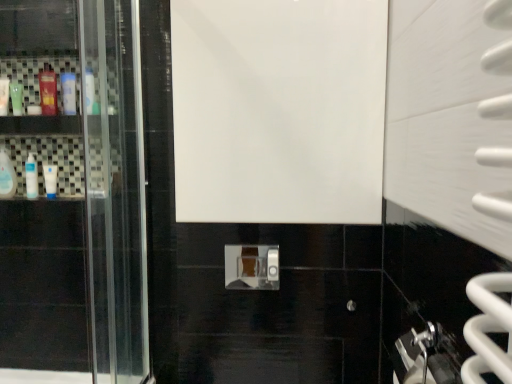
What is the approximate height of white glossy bottle at left, acting as the fourth mouthwash starting from the right?

white glossy bottle at left, acting as the fourth mouthwash starting from the right, is 8.42 inches in height.

Find the location of `white glossy door at center`. white glossy door at center is located at coordinates (74, 197).

Locate an element on the screen. This screenshot has height=384, width=512. translucent plastic mouthwash at upper left, acting as the fifth mouthwash starting from the left is located at coordinates (48, 90).

How different are the orientations of clear plastic bottle at left, which is the first mouthwash in left-to-right order, and white glossy bottle at left, positioned as the third mouthwash in left-to-right order, in degrees?

They differ by 0.000116 degrees in their facing directions.

At what (x,y) coordinates should I click in order to perform the action: click on the 2nd mouthwash behind the clear plastic bottle at left, which is the first mouthwash in left-to-right order, counting from the anchor's position. Please return your answer as a coordinate pair (x, y). The width and height of the screenshot is (512, 384). Looking at the image, I should click on (31, 177).

Are clear plastic bottle at left, which is the first mouthwash in left-to-right order, and white glossy bottle at left, acting as the fourth mouthwash starting from the right, located far from each other?

Actually, clear plastic bottle at left, which is the first mouthwash in left-to-right order, and white glossy bottle at left, acting as the fourth mouthwash starting from the right, are a little close together.

Is clear plastic bottle at left, the 6th mouthwash from the right, situated inside white glossy bottle at left, acting as the fourth mouthwash starting from the right, or outside?

The correct answer is: outside.

Which object is positioned more to the right, white glossy bottle at left, acting as the fourth mouthwash starting from the right, or white glossy door at center?

white glossy door at center is more to the right.

From the image's perspective, is white glossy bottle at left, acting as the fourth mouthwash starting from the right, located beneath white glossy door at center?

No, from the image's perspective, white glossy bottle at left, acting as the fourth mouthwash starting from the right, is not beneath white glossy door at center.

Does white glossy bottle at left, acting as the fourth mouthwash starting from the right, contain white glossy door at center?

No, white glossy door at center is located outside of white glossy bottle at left, acting as the fourth mouthwash starting from the right.

Does white glossy bottle at left, positioned as the third mouthwash in left-to-right order, have a greater height compared to white glossy door at center?

Incorrect, the height of white glossy bottle at left, positioned as the third mouthwash in left-to-right order, is not larger of that of white glossy door at center.

Where is `the 2nd mouthwash behind when counting from the translucent plastic mouthwash at upper left, marked as the second mouthwash in a right-to-left arrangement`? This screenshot has height=384, width=512. the 2nd mouthwash behind when counting from the translucent plastic mouthwash at upper left, marked as the second mouthwash in a right-to-left arrangement is located at coordinates (17, 98).

Is green matte bottle at left, the second mouthwash when ordered from left to right, to the right of translucent plastic mouthwash at upper left, acting as the fifth mouthwash starting from the left, from the viewer's perspective?

No, green matte bottle at left, the second mouthwash when ordered from left to right, is not to the right of translucent plastic mouthwash at upper left, acting as the fifth mouthwash starting from the left.

Considering the points (15, 114) and (48, 66), which point is in front, point (15, 114) or point (48, 66)?

The point (15, 114) is in front.

Looking at their sizes, would you say green matte bottle at left, which is the fifth mouthwash from right to left, is wider or thinner than translucent plastic mouthwash at upper left, marked as the second mouthwash in a right-to-left arrangement?

green matte bottle at left, which is the fifth mouthwash from right to left, is thinner than translucent plastic mouthwash at upper left, marked as the second mouthwash in a right-to-left arrangement.

Would you say translucent plastic mouthwash at upper left, marked as the second mouthwash in a right-to-left arrangement, is part of white glossy bottle at left, positioned as the third mouthwash in left-to-right order,'s contents?

That's incorrect, translucent plastic mouthwash at upper left, marked as the second mouthwash in a right-to-left arrangement, is not inside white glossy bottle at left, positioned as the third mouthwash in left-to-right order.

Looking at this image, are white glossy bottle at left, acting as the fourth mouthwash starting from the right, and translucent plastic mouthwash at upper left, marked as the second mouthwash in a right-to-left arrangement, located far from each other?

No, white glossy bottle at left, acting as the fourth mouthwash starting from the right, is not far from translucent plastic mouthwash at upper left, marked as the second mouthwash in a right-to-left arrangement.

How different are the orientations of white glossy bottle at left, acting as the fourth mouthwash starting from the right, and translucent plastic mouthwash at upper left, marked as the second mouthwash in a right-to-left arrangement, in degrees?

They differ by 0.000824 degrees in their facing directions.

From the image's perspective, which one is positioned lower, white glossy bottle at left, acting as the fourth mouthwash starting from the right, or translucent plastic mouthwash at upper left, marked as the second mouthwash in a right-to-left arrangement?

white glossy bottle at left, acting as the fourth mouthwash starting from the right, from the image's perspective.

From the image's perspective, which one is positioned lower, white glossy bottle at left, positioned as the third mouthwash in left-to-right order, or white glossy tube at left, the 4th mouthwash in the left-to-right sequence?

white glossy tube at left, the 4th mouthwash in the left-to-right sequence.

Considering the sizes of objects white glossy bottle at left, positioned as the third mouthwash in left-to-right order, and white glossy tube at left, which appears as the 3th mouthwash when viewed from the right, in the image provided, who is bigger, white glossy bottle at left, positioned as the third mouthwash in left-to-right order, or white glossy tube at left, which appears as the 3th mouthwash when viewed from the right,?

With larger size is white glossy tube at left, which appears as the 3th mouthwash when viewed from the right.

In the scene shown: From a real-world perspective, which is physically below, white glossy bottle at left, acting as the fourth mouthwash starting from the right, or white glossy tube at left, which appears as the 3th mouthwash when viewed from the right?

From a 3D spatial view, white glossy tube at left, which appears as the 3th mouthwash when viewed from the right, is below.

Is white glossy bottle at left, acting as the fourth mouthwash starting from the right, far away from white glossy tube at left, which appears as the 3th mouthwash when viewed from the right?

They are positioned close to each other.

The width and height of the screenshot is (512, 384). Find the location of `mouthwash that is the 2nd object located below the white glossy bottle at left, the 1th mouthwash from the right (from the image's perspective)`. mouthwash that is the 2nd object located below the white glossy bottle at left, the 1th mouthwash from the right (from the image's perspective) is located at coordinates (7, 175).

Does white glossy bottle at left, the 1th mouthwash from the right, contain clear plastic bottle at left, which is the first mouthwash in left-to-right order?

No, clear plastic bottle at left, which is the first mouthwash in left-to-right order, is not a part of white glossy bottle at left, the 1th mouthwash from the right.

Would you say white glossy bottle at left, the 1th mouthwash from the right, is to the left or to the right of clear plastic bottle at left, which is the first mouthwash in left-to-right order, in the picture?

Based on their positions, white glossy bottle at left, the 1th mouthwash from the right, is located to the right of clear plastic bottle at left, which is the first mouthwash in left-to-right order.

Between white glossy door at center and white glossy bottle at left, which is the sixth mouthwash from left to right, which one appears on the right side from the viewer's perspective?

white glossy bottle at left, which is the sixth mouthwash from left to right, is more to the right.

Is white glossy door at center positioned with its back to white glossy bottle at left, which is the sixth mouthwash from left to right?

Correct, white glossy door at center is looking away from white glossy bottle at left, which is the sixth mouthwash from left to right.

Which of these two, white glossy door at center or white glossy bottle at left, the 1th mouthwash from the right, is thinner?

With smaller width is white glossy bottle at left, the 1th mouthwash from the right.

Considering the relative sizes of white glossy door at center and white glossy bottle at left, the 1th mouthwash from the right, in the image provided, is white glossy door at center bigger than white glossy bottle at left, the 1th mouthwash from the right,?

Yes.

The height and width of the screenshot is (384, 512). Find the location of `mouthwash that is the 1st one when counting downward from the clear plastic bottle at left, which is the first mouthwash in left-to-right order (from the image's perspective)`. mouthwash that is the 1st one when counting downward from the clear plastic bottle at left, which is the first mouthwash in left-to-right order (from the image's perspective) is located at coordinates (31, 177).

From the image's perspective, which mouthwash is the 2nd one above the white glossy door at center? Please provide its 2D coordinates.

[(31, 177)]

From the image, which object appears to be farther from clear plastic bottle at left, the 6th mouthwash from the right, translucent plastic mouthwash at upper left, marked as the second mouthwash in a right-to-left arrangement, or white glossy door at center?

white glossy door at center is positioned further to the anchor clear plastic bottle at left, the 6th mouthwash from the right.

Looking at the image, which one is located further to white glossy door at center, white glossy tube at left, the 4th mouthwash in the left-to-right sequence, or clear plastic bottle at left, the 6th mouthwash from the right?

clear plastic bottle at left, the 6th mouthwash from the right.

Based on their spatial positions, is clear plastic bottle at left, which is the first mouthwash in left-to-right order, or translucent plastic mouthwash at upper left, acting as the fifth mouthwash starting from the left, closer to green matte bottle at left, which is the fifth mouthwash from right to left?

The object closer to green matte bottle at left, which is the fifth mouthwash from right to left, is translucent plastic mouthwash at upper left, acting as the fifth mouthwash starting from the left.

Which object lies further to the anchor point translucent plastic mouthwash at upper left, marked as the second mouthwash in a right-to-left arrangement, clear plastic bottle at left, the 6th mouthwash from the right, or white glossy bottle at left, acting as the fourth mouthwash starting from the right?

clear plastic bottle at left, the 6th mouthwash from the right.

From the image, which object appears to be nearer to clear plastic bottle at left, which is the first mouthwash in left-to-right order, white glossy tube at left, which appears as the 3th mouthwash when viewed from the right, or white glossy door at center?

Based on the image, white glossy tube at left, which appears as the 3th mouthwash when viewed from the right, appears to be nearer to clear plastic bottle at left, which is the first mouthwash in left-to-right order.

Based on their spatial positions, is clear plastic bottle at left, the 6th mouthwash from the right, or white glossy bottle at left, which is the sixth mouthwash from left to right, further from green matte bottle at left, the second mouthwash when ordered from left to right?

clear plastic bottle at left, the 6th mouthwash from the right, is positioned further to the anchor green matte bottle at left, the second mouthwash when ordered from left to right.

When comparing their distances from white glossy tube at left, which appears as the 3th mouthwash when viewed from the right, does white glossy bottle at left, which is the sixth mouthwash from left to right, or white glossy bottle at left, positioned as the third mouthwash in left-to-right order, seem further?

white glossy bottle at left, which is the sixth mouthwash from left to right, is positioned further to the anchor white glossy tube at left, which appears as the 3th mouthwash when viewed from the right.

Which object lies nearer to the anchor point white glossy bottle at left, the 1th mouthwash from the right, white glossy tube at left, the 4th mouthwash in the left-to-right sequence, or white glossy bottle at left, acting as the fourth mouthwash starting from the right?

white glossy tube at left, the 4th mouthwash in the left-to-right sequence, lies closer to white glossy bottle at left, the 1th mouthwash from the right, than the other object.

I want to click on mouthwash that lies between green matte bottle at left, the second mouthwash when ordered from left to right, and white glossy bottle at left, positioned as the third mouthwash in left-to-right order, from top to bottom, so click(x=7, y=175).

Locate an element on the screen. The width and height of the screenshot is (512, 384). mouthwash between white glossy bottle at left, which is the sixth mouthwash from left to right, and clear plastic bottle at left, the 6th mouthwash from the right, from top to bottom is located at coordinates (17, 98).

The image size is (512, 384). Find the location of `mouthwash between white glossy door at center and white glossy bottle at left, which is the sixth mouthwash from left to right, in the front-back direction`. mouthwash between white glossy door at center and white glossy bottle at left, which is the sixth mouthwash from left to right, in the front-back direction is located at coordinates (48, 90).